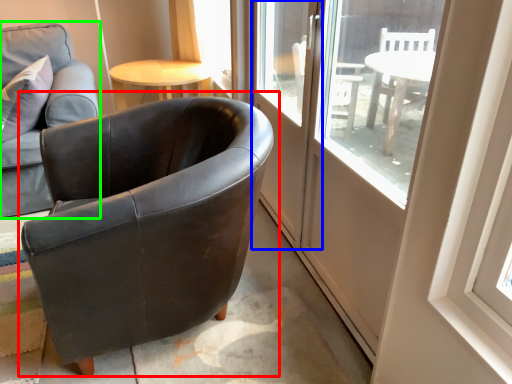
Question: Based on their relative distances, which object is nearer to chair (highlighted by a red box)? Choose from screen door (highlighted by a blue box) and chair (highlighted by a green box).

Choices:
 (A) screen door
 (B) chair

Answer: (A)